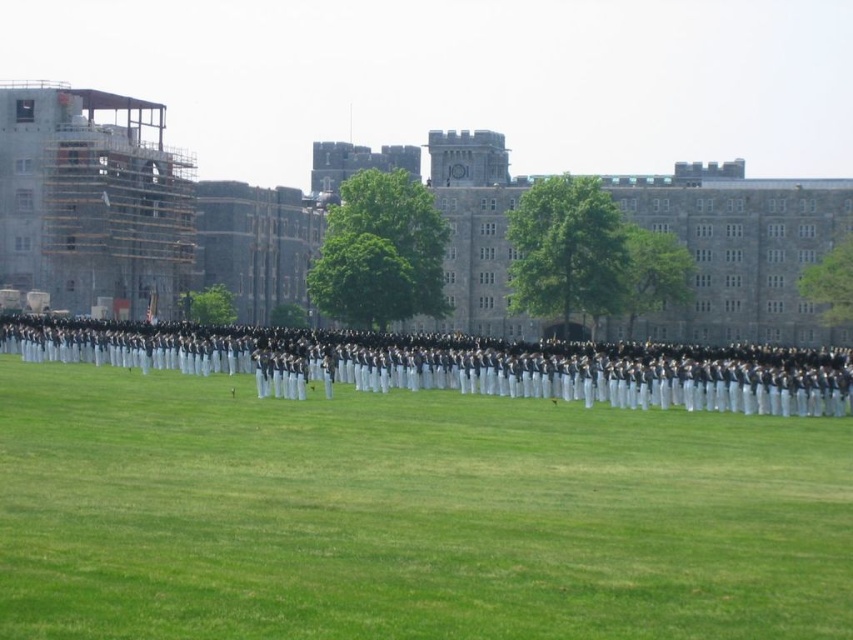
You are a drone operator tasked with capturing aerial footage of the military gathering. The drone must fly from the scaffolding wood at left to the green grass at center. What is the approximate distance the drone needs to cover?

The green grass at center is 75.28 meters from the scaffolding wood at left, so the drone needs to cover approximately 75.28 meters to fly from the scaffolding wood at left to the green grass at center.

You are a photographer positioned at the back of the military formation. You want to take a photo of the green grass at center without the scaffolding wood at left appearing in the frame. Is this possible?

The green grass at center is in front of the scaffolding wood at left, so the scaffolding wood at left will be obscured by the green grass at center in the photo. Therefore, it is possible to take a photo of the green grass at center without the scaffolding wood at left appearing in the frame.